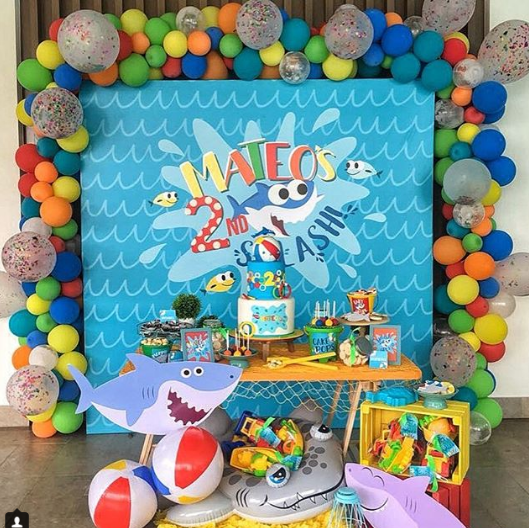
Where is `birthday cake`? The height and width of the screenshot is (528, 529). birthday cake is located at coordinates (260, 306).